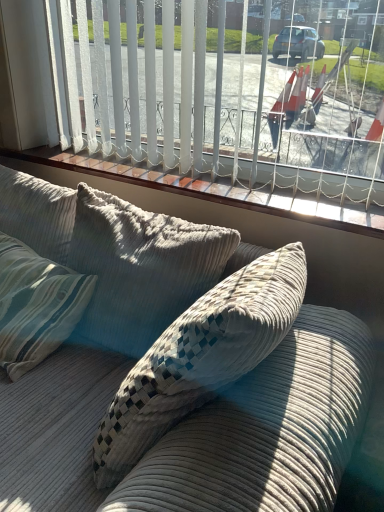
Find the location of a particular element. Image resolution: width=384 pixels, height=512 pixels. white vertical blinds at upper center is located at coordinates (205, 104).

Find the location of a particular element. The width and height of the screenshot is (384, 512). corduroy couch at center is located at coordinates (180, 366).

The height and width of the screenshot is (512, 384). Find the location of `wooden window sill at upper center`. wooden window sill at upper center is located at coordinates (219, 190).

Can you confirm if corduroy couch at center is taller than white vertical blinds at upper center?

Indeed, corduroy couch at center has a greater height compared to white vertical blinds at upper center.

Between point (283, 476) and point (21, 120), which one is positioned in front?

The point (283, 476) is more forward.

Considering the sizes of corduroy couch at center and white vertical blinds at upper center in the image, is corduroy couch at center wider or thinner than white vertical blinds at upper center?

Considering their sizes, corduroy couch at center looks broader than white vertical blinds at upper center.

From the image's perspective, is corduroy couch at center positioned above or below white vertical blinds at upper center?

corduroy couch at center is below white vertical blinds at upper center.

Considering the positions of points (338, 164) and (337, 198), is point (338, 164) closer to camera compared to point (337, 198)?

Yes.

Which object is thinner, white vertical blinds at upper center or wooden window sill at upper center?

Thinner between the two is white vertical blinds at upper center.

Which object is positioned more to the right, white vertical blinds at upper center or wooden window sill at upper center?

white vertical blinds at upper center.

Is white vertical blinds at upper center oriented away from wooden window sill at upper center?

That's not correct — white vertical blinds at upper center is not looking away from wooden window sill at upper center.

Does wooden window sill at upper center have a lesser width compared to corduroy couch at center?

Correct, the width of wooden window sill at upper center is less than that of corduroy couch at center.

In terms of size, does wooden window sill at upper center appear bigger or smaller than corduroy couch at center?

Considering their sizes, wooden window sill at upper center takes up less space than corduroy couch at center.

Which object is closer to the camera taking this photo, wooden window sill at upper center or corduroy couch at center?

Positioned in front is corduroy couch at center.

Visually, is corduroy couch at center positioned to the left or to the right of wooden window sill at upper center?

Based on their positions, corduroy couch at center is located to the right of wooden window sill at upper center.

Can you confirm if corduroy couch at center is taller than wooden window sill at upper center?

Indeed, corduroy couch at center has a greater height compared to wooden window sill at upper center.

In the image, is corduroy couch at center positioned in front of or behind wooden window sill at upper center?

corduroy couch at center is positioned closer to the viewer than wooden window sill at upper center.

Looking at this image, is wooden window sill at upper center located within corduroy couch at center?

That's incorrect, wooden window sill at upper center is not inside corduroy couch at center.

Between white vertical blinds at upper center and corduroy couch at center, which one has smaller size?

white vertical blinds at upper center.

Is white vertical blinds at upper center not near corduroy couch at center?

No, there isn't a large distance between white vertical blinds at upper center and corduroy couch at center.

You are a GUI agent. You are given a task and a screenshot of the screen. Output one action in this format:
    pyautogui.click(x=<x>, y=<y>)
    Task: Click on the window above the corduroy couch at center (from a real-world perspective)
    The width and height of the screenshot is (384, 512).
    Given the screenshot: What is the action you would take?
    pyautogui.click(x=205, y=104)

Does point (185, 174) come farther from viewer compared to point (242, 280)?

Yes.

Is point (375, 224) less distant than point (278, 181)?

Yes, it is in front of point (278, 181).

Based on the photo, considering the sizes of wooden window sill at upper center and white vertical blinds at upper center in the image, is wooden window sill at upper center bigger or smaller than white vertical blinds at upper center?

wooden window sill at upper center is smaller than white vertical blinds at upper center.

From a real-world perspective, is wooden window sill at upper center below white vertical blinds at upper center?

Indeed, from a real-world perspective, wooden window sill at upper center is positioned beneath white vertical blinds at upper center.

Considering the relative sizes of wooden window sill at upper center and white vertical blinds at upper center in the image provided, is wooden window sill at upper center shorter than white vertical blinds at upper center?

Correct, wooden window sill at upper center is not as tall as white vertical blinds at upper center.

This screenshot has width=384, height=512. Identify the location of window located above the corduroy couch at center (from the image's perspective). (205, 104).

You are a GUI agent. You are given a task and a screenshot of the screen. Output one action in this format:
    pyautogui.click(x=<x>, y=<y>)
    Task: Click on the window on the right of wooden window sill at upper center
    Image resolution: width=384 pixels, height=512 pixels.
    Given the screenshot: What is the action you would take?
    pyautogui.click(x=205, y=104)

Estimate the real-world distances between objects in this image. Which object is further from wooden window sill at upper center, white vertical blinds at upper center or corduroy couch at center?

Based on the image, corduroy couch at center appears to be further to wooden window sill at upper center.

When comparing their distances from corduroy couch at center, does wooden window sill at upper center or white vertical blinds at upper center seem closer?

Among the two, wooden window sill at upper center is located nearer to corduroy couch at center.

Considering their positions, is wooden window sill at upper center positioned closer to white vertical blinds at upper center than corduroy couch at center?

Based on the image, wooden window sill at upper center appears to be nearer to white vertical blinds at upper center.

Considering their positions, is corduroy couch at center positioned closer to wooden window sill at upper center than white vertical blinds at upper center?

white vertical blinds at upper center lies closer to wooden window sill at upper center than the other object.

Which object lies further to the anchor point white vertical blinds at upper center, corduroy couch at center or wooden window sill at upper center?

corduroy couch at center is further to white vertical blinds at upper center.

When comparing their distances from corduroy couch at center, does white vertical blinds at upper center or wooden window sill at upper center seem closer?

Based on the image, wooden window sill at upper center appears to be nearer to corduroy couch at center.

Locate an element on the screen. window sill between white vertical blinds at upper center and corduroy couch at center in the vertical direction is located at coordinates (219, 190).